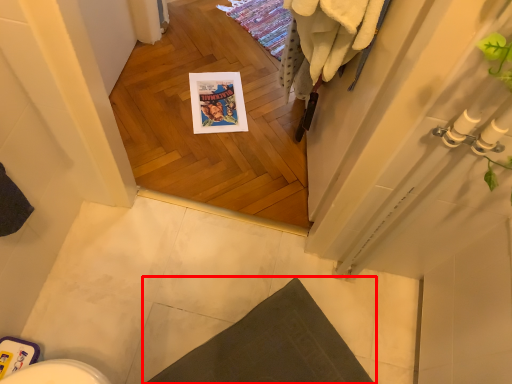
Question: Observing the image, what is the correct spatial positioning of bath mat (annotated by the red box) in reference to bath towel?

Choices:
 (A) left
 (B) right

Answer: (A)